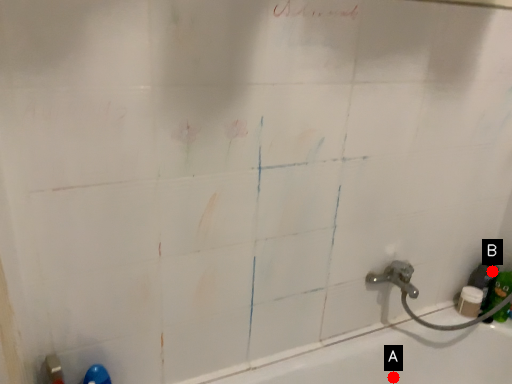
Question: Two points are circled on the image, labeled by A and B beside each circle. Which point is farther from the camera taking this photo?

Choices:
 (A) A is further
 (B) B is further

Answer: (B)